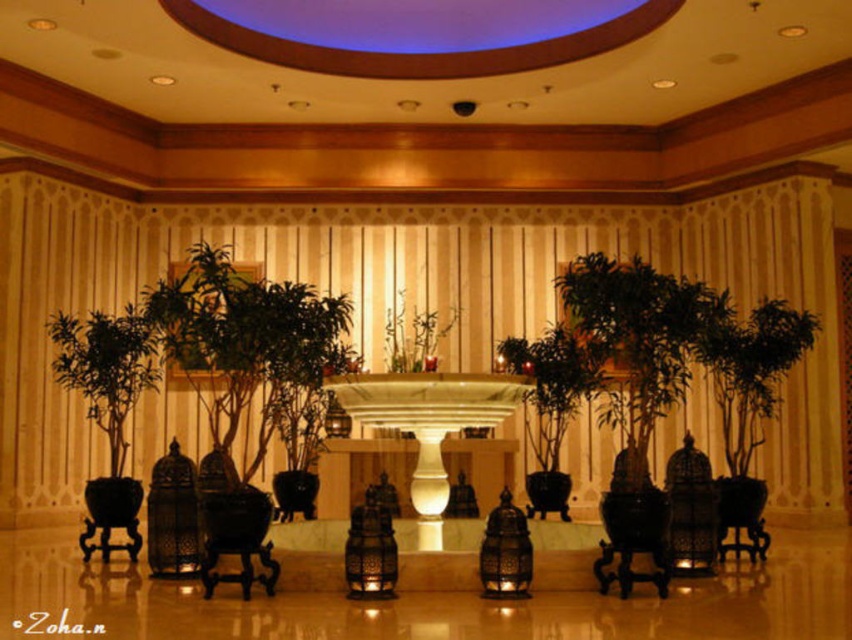
Does green matte plant at left have a greater height compared to metallic ornate lantern at center?

Yes, green matte plant at left is taller than metallic ornate lantern at center.

The image size is (852, 640). I want to click on green matte plant at left, so click(x=106, y=368).

You are a GUI agent. You are given a task and a screenshot of the screen. Output one action in this format:
    pyautogui.click(x=<x>, y=<y>)
    Task: Click on the green matte plant at left
    The image size is (852, 640).
    Given the screenshot: What is the action you would take?
    pyautogui.click(x=106, y=368)

Is green matte plant at left bigger than green matte vase at center?

Yes.

Is point (52, 339) positioned behind point (430, 353)?

No, it is not.

What do you see at coordinates (106, 368) in the screenshot? I see `green matte plant at left` at bounding box center [106, 368].

Image resolution: width=852 pixels, height=640 pixels. Identify the location of green matte plant at left. (106, 368).

In the scene shown: Between black polished wood armchair at center and green matte vase at center, which one appears on the right side from the viewer's perspective?

→ green matte vase at center is more to the right.

Can you confirm if black polished wood armchair at center is positioned to the right of green matte vase at center?

Incorrect, black polished wood armchair at center is not on the right side of green matte vase at center.

Locate an element on the screen. black polished wood armchair at center is located at coordinates (232, 525).